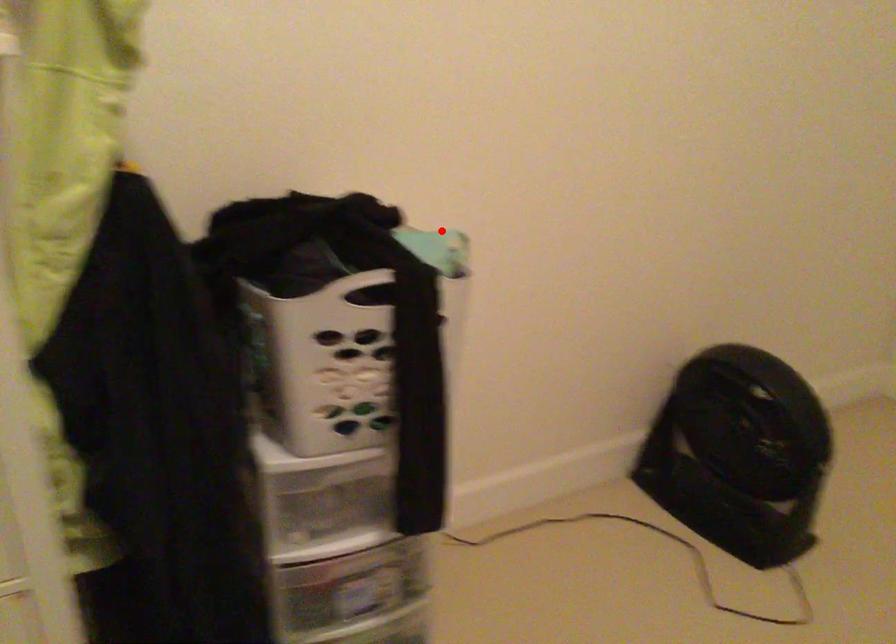
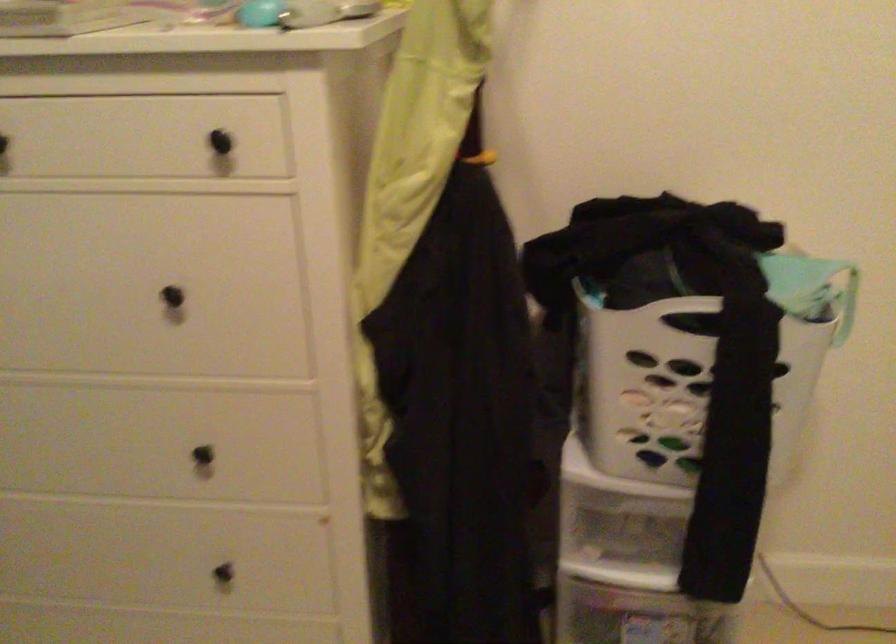
In the second image, find the point that corresponds to the highlighted location in the first image.

(825, 261)